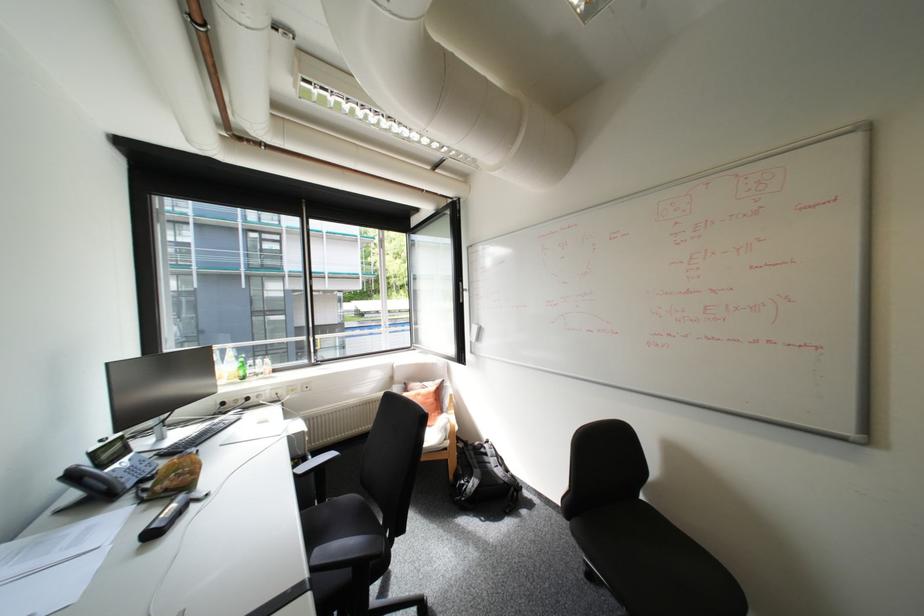
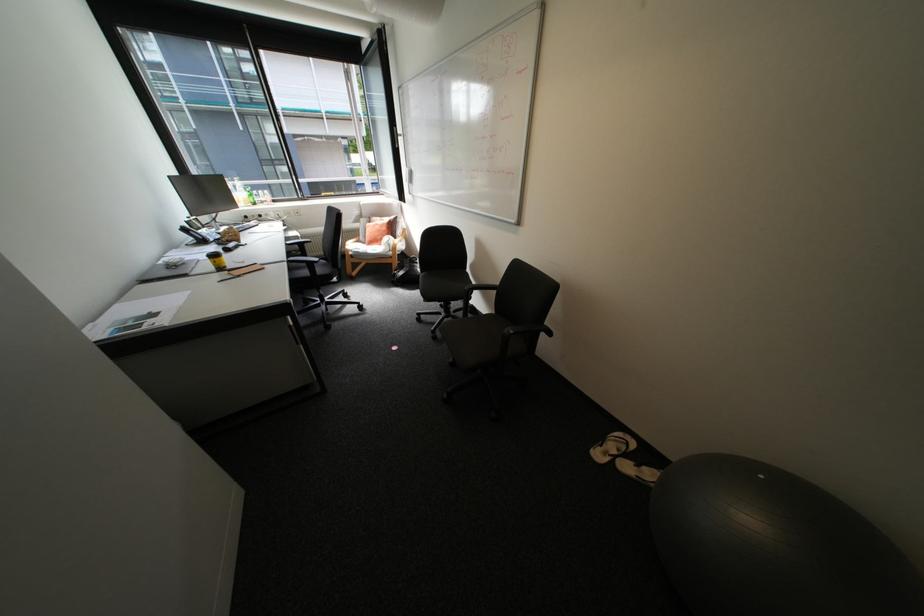
Locate, in the second image, the point that corresponds to (305,475) in the first image.

(296, 244)